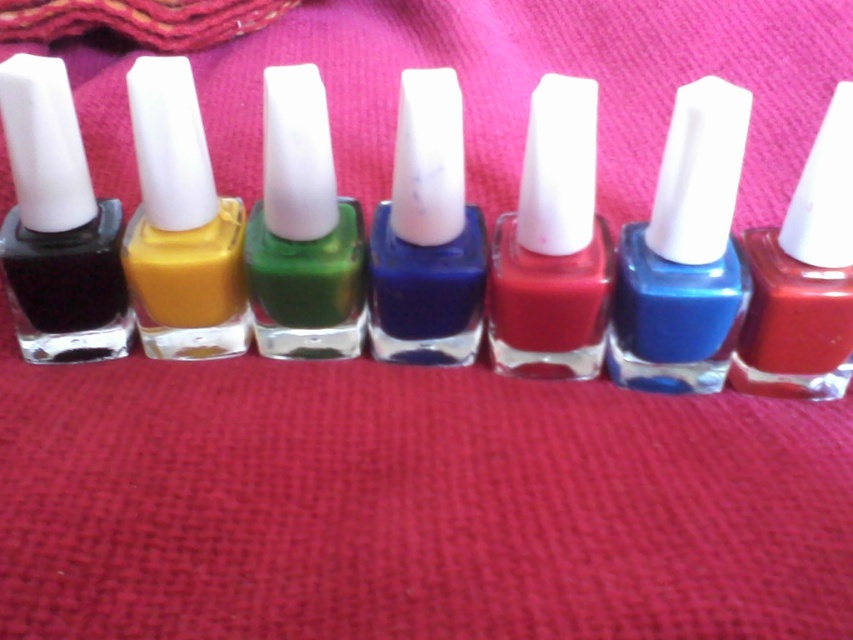
Which of these two, matte black nail polish at left or matte blue nail polish at center, stands shorter?

matte blue nail polish at center

Is matte black nail polish at left behind matte blue nail polish at center?

Yes, matte black nail polish at left is behind matte blue nail polish at center.

Identify the location of matte black nail polish at left. This screenshot has width=853, height=640. (57, 225).

Image resolution: width=853 pixels, height=640 pixels. In order to click on matte black nail polish at left in this screenshot , I will do `click(57, 225)`.

Is shiny blue nail polish at center below matte blue nail polish at center?

Indeed, shiny blue nail polish at center is positioned under matte blue nail polish at center.

Is shiny blue nail polish at center above matte blue nail polish at center?

No.

Where is `shiny blue nail polish at center`? This screenshot has width=853, height=640. shiny blue nail polish at center is located at coordinates (683, 252).

Which is behind, point (41, 212) or point (132, 129)?

Point (41, 212)

Is matte black nail polish at left closer to the viewer compared to matte yellow nail polish at center?

Yes, it is in front of matte yellow nail polish at center.

Is point (57, 70) farther from camera compared to point (206, 172)?

No, (57, 70) is in front of (206, 172).

Identify the location of matte black nail polish at left. The width and height of the screenshot is (853, 640). (57, 225).